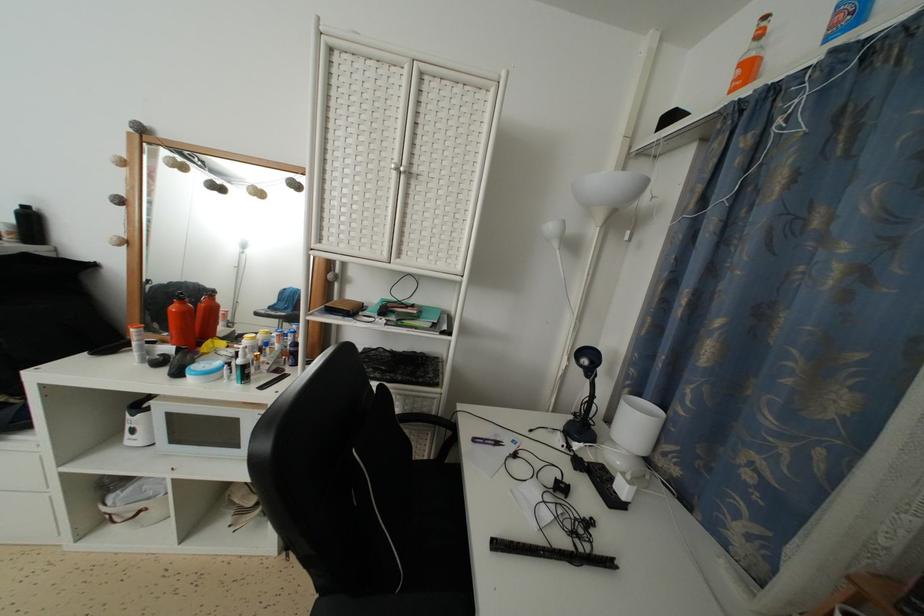
Where is `black chair armrest`? The image size is (924, 616). black chair armrest is located at coordinates (393, 605).